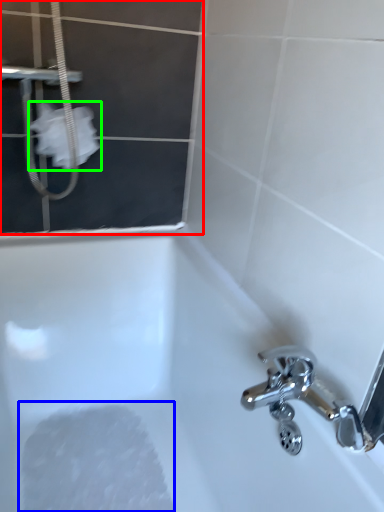
Question: Based on their relative distances, which object is nearer to screen door (highlighted by a red box)? Choose from foam (highlighted by a blue box) and toilet paper (highlighted by a green box).

Choices:
 (A) foam
 (B) toilet paper

Answer: (B)